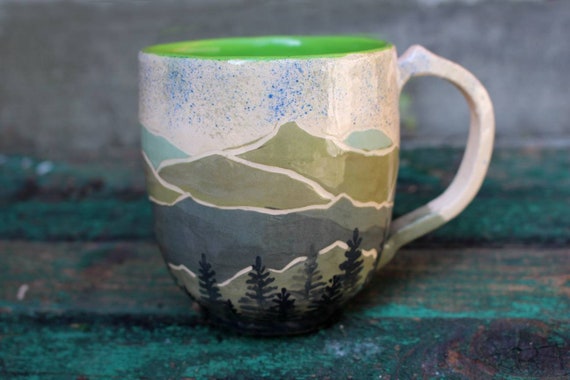
Find the location of a particular element. wall is located at coordinates (109, 65).